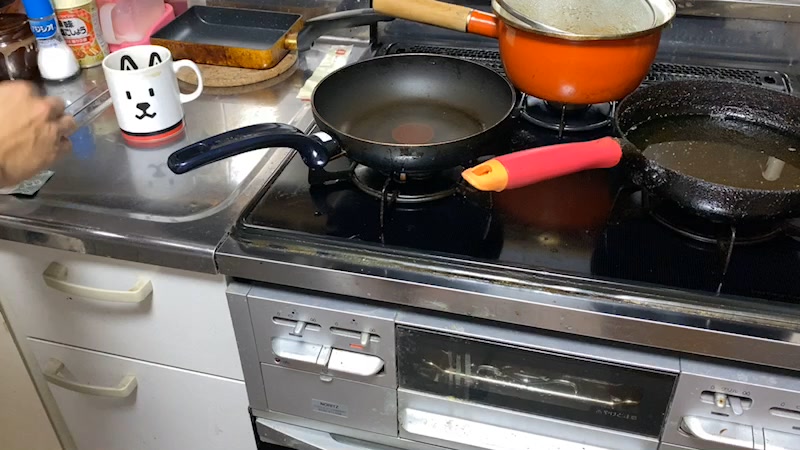
This screenshot has height=450, width=800. I want to click on handles/where i'd pick up a pan, so click(230, 140), click(405, 10), click(506, 170), click(333, 23).